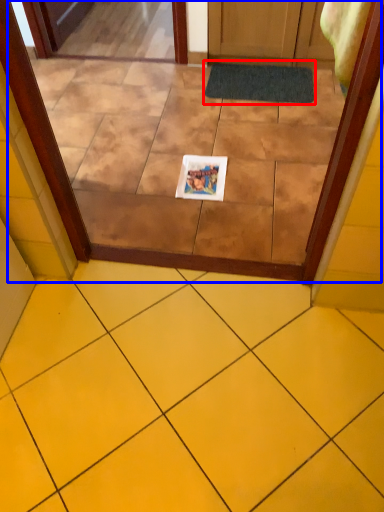
Question: Which object appears closest to the camera in this image, bath mat (highlighted by a red box) or glass door (highlighted by a blue box)?

Choices:
 (A) bath mat
 (B) glass door

Answer: (B)